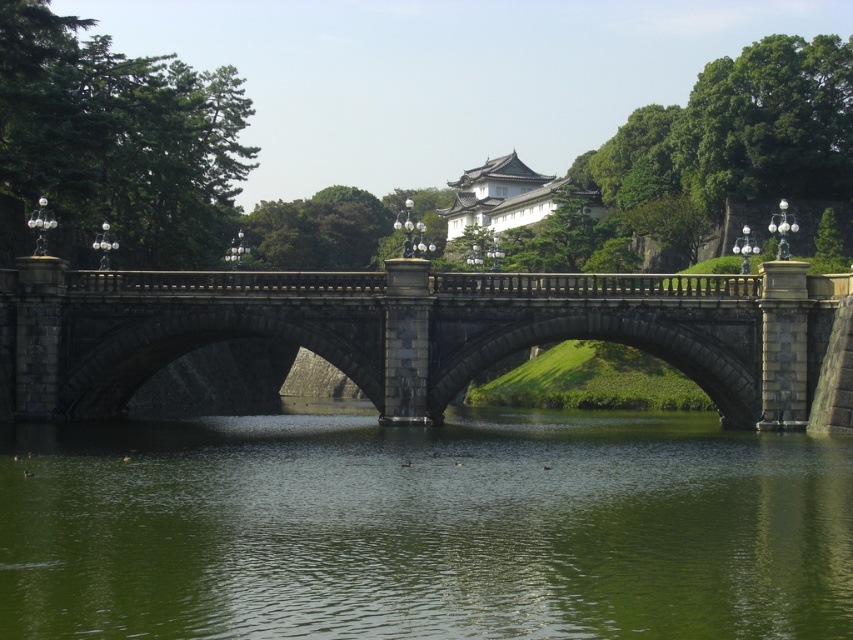
Does green smooth water at center appear on the left side of dark gray stone bridge at center?

No, green smooth water at center is not to the left of dark gray stone bridge at center.

Is point (695, 618) positioned in front of point (329, 342)?

Yes, point (695, 618) is closer to viewer.

Is point (520, 428) closer to viewer compared to point (404, 419)?

No, (520, 428) is behind (404, 419).

The width and height of the screenshot is (853, 640). What are the coordinates of `green smooth water at center` in the screenshot? It's located at (424, 528).